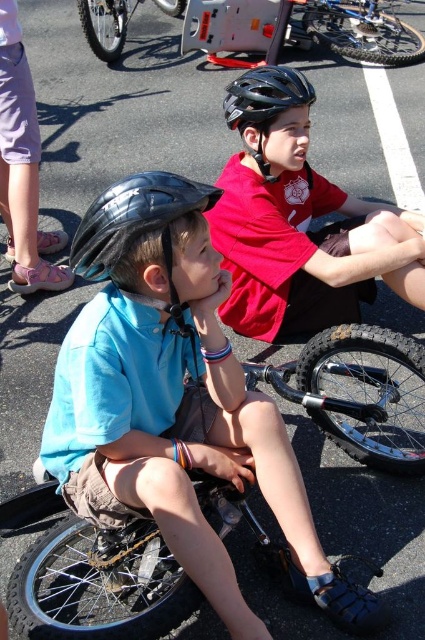
Question: Does matte black helmet at center appear on the right side of silver metallic bicycle wheel at upper left?

Choices:
 (A) no
 (B) yes

Answer: (B)

Question: In this image, where is pink fabric shorts at lower left located relative to black matte helmet at left?

Choices:
 (A) left
 (B) right

Answer: (A)

Question: Which of these objects is positioned farthest from the blue metallic bicycle at center?

Choices:
 (A) matte blue helmet at left
 (B) matte black helmet at center

Answer: (A)

Question: Considering the real-world distances, which object is closest to the black matte helmet at left?

Choices:
 (A) matte blue helmet at left
 (B) matte black helmet at center

Answer: (A)

Question: Does matte black helmet at center lie behind silver metallic bicycle wheel at upper left?

Choices:
 (A) yes
 (B) no

Answer: (B)

Question: Which of the following is the closest to the observer?

Choices:
 (A) (297, 92)
 (B) (23, 259)
 (C) (119, 252)

Answer: (C)